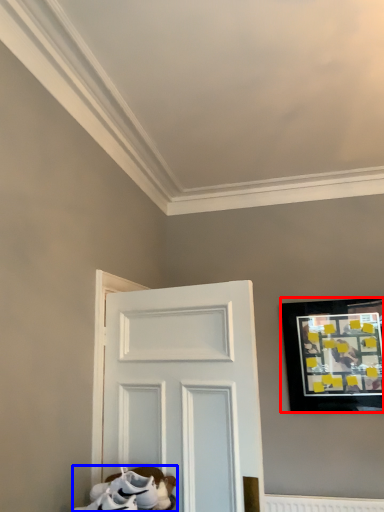
Question: Among these objects, which one is farthest to the camera, picture frame (highlighted by a red box) or footwear (highlighted by a blue box)?

Choices:
 (A) picture frame
 (B) footwear

Answer: (A)